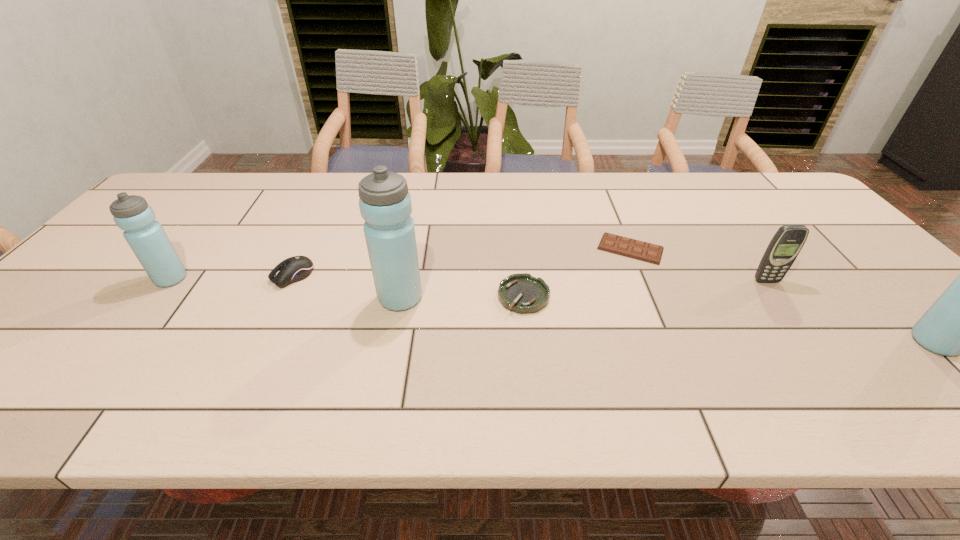
To achieve even spacing by inserting another water_bottle among them, please point to a vacant spot for this new water_bottle. Please provide its 2D coordinates. Your answer should be formatted as a tuple, i.e. [(x, y)], where the tuple contains the x and y coordinates of a point satisfying the conditions above.

[(654, 319)]